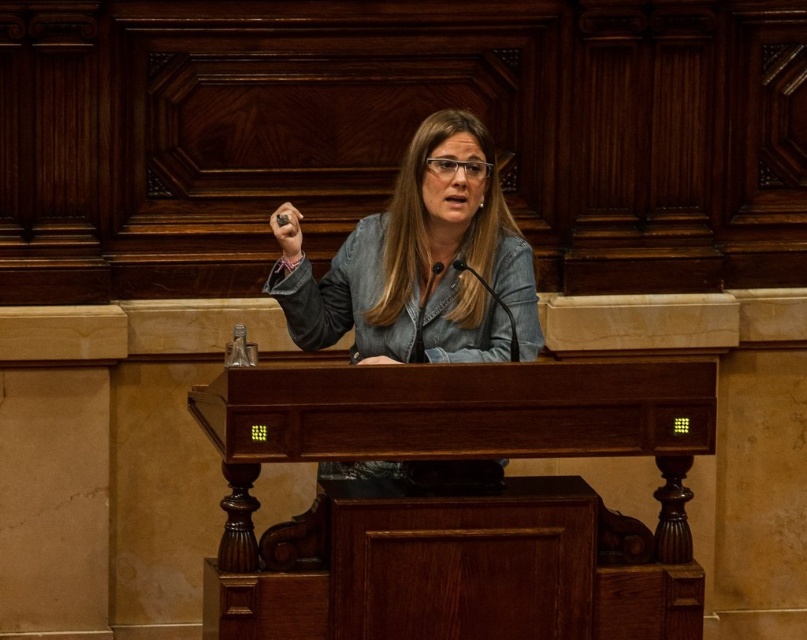
You are attending a formal event and need to place a name tag on either the wooden podium at center or the denim jacket at center. Based on their positions, which one is more accessible for placing the name tag without moving closer?

The wooden podium at center is closer to the viewer than the denim jacket at center, so placing the name tag on the wooden podium at center would be more accessible without needing to move closer.

You are an event planner setting up a stage for a speech. You see the wooden podium at center and the black plastic microphone at center. Which object is positioned to the left when viewed from the audience perspective?

The wooden podium at center is to the left of the black plastic microphone at center, so the wooden podium at center is positioned to the left when viewed from the audience perspective.

You are standing in front of the podium and want to place a small object on the surface between the two points labeled point (479,147) and point (509,330). Which point is closer to you so you can reach it easily?

Point (479,147) is closer to you than point (509,330), so you can reach it more easily.